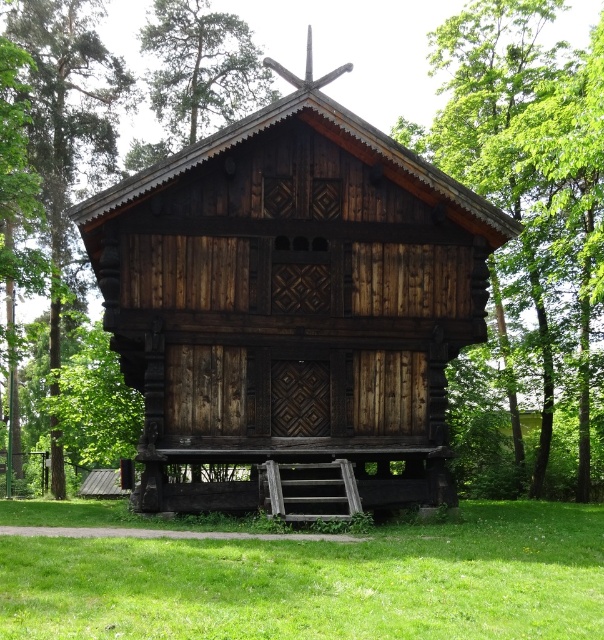
Does dark brown wooden log cabin at center appear on the right side of green wood tree at upper center?

Correct, you'll find dark brown wooden log cabin at center to the right of green wood tree at upper center.

Does dark brown wooden log cabin at center lie in front of green wood tree at upper center?

Yes, dark brown wooden log cabin at center is in front of green wood tree at upper center.

I want to click on dark brown wooden log cabin at center, so click(292, 300).

Does green wood tree at left have a smaller size compared to green wood tree at upper center?

Actually, green wood tree at left might be larger than green wood tree at upper center.

Is point (104, 77) in front of point (240, 106)?

Yes.

Locate an element on the screen. green wood tree at left is located at coordinates (68, 115).

You are a GUI agent. You are given a task and a screenshot of the screen. Output one action in this format:
    pyautogui.click(x=<x>, y=<y>)
    Task: Click on the green wood tree at left
    
    Given the screenshot: What is the action you would take?
    pyautogui.click(x=68, y=115)

Looking at this image, which is above, dark brown wooden log cabin at center or green wood tree at left?

green wood tree at left is higher up.

Between dark brown wooden log cabin at center and green wood tree at left, which one appears on the left side from the viewer's perspective?

green wood tree at left is more to the left.

Is point (259, 172) farther from viewer compared to point (45, 16)?

That is False.

Locate an element on the screen. dark brown wooden log cabin at center is located at coordinates (292, 300).